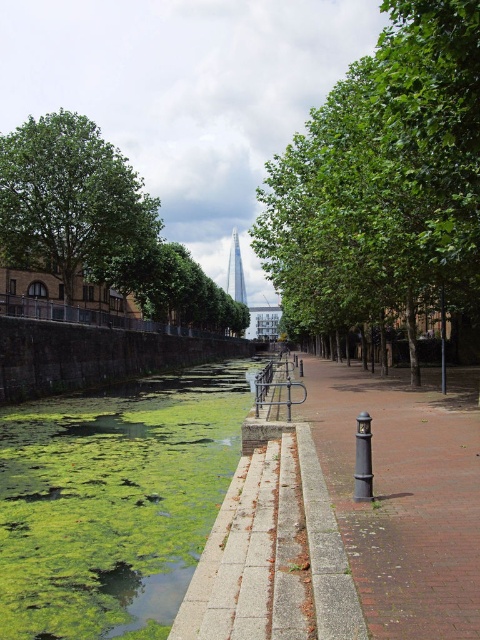
Who is positioned more to the right, green leafy tree at center or green algae at center?

Positioned to the right is green leafy tree at center.

This screenshot has width=480, height=640. I want to click on green leafy tree at center, so click(383, 179).

Does green algae at center appear under green leafy tree at left?

Correct, green algae at center is located below green leafy tree at left.

Can you confirm if green algae at center is taller than green leafy tree at left?

No.

The image size is (480, 640). What do you see at coordinates (113, 500) in the screenshot? I see `green algae at center` at bounding box center [113, 500].

At what (x,y) coordinates should I click in order to perform the action: click on green algae at center. Please return your answer as a coordinate pair (x, y). The image size is (480, 640). Looking at the image, I should click on (113, 500).

Which of these two, green leafy tree at center or brick pavement at center, stands taller?

green leafy tree at center is taller.

Is green leafy tree at center smaller than brick pavement at center?

Incorrect, green leafy tree at center is not smaller in size than brick pavement at center.

Does point (343, 308) come behind point (422, 429)?

Yes, point (343, 308) is behind point (422, 429).

Image resolution: width=480 pixels, height=640 pixels. I want to click on green leafy tree at center, so click(383, 179).